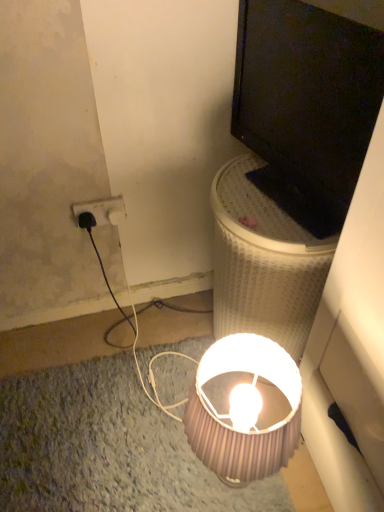
Question: Is black glossy monitor at upper right bigger or smaller than white mesh laundry basket at upper right?

Choices:
 (A) small
 (B) big

Answer: (A)

Question: From their relative heights in the image, would you say black glossy monitor at upper right is taller or shorter than white mesh laundry basket at upper right?

Choices:
 (A) short
 (B) tall

Answer: (A)

Question: Estimate the real-world distances between objects in this image. Which object is farther from the white mesh laundry basket at upper right?

Choices:
 (A) pink ribbed lampshade at lower center
 (B) black plastic power outlet at upper left
 (C) black glossy monitor at upper right

Answer: (B)

Question: Considering the real-world distances, which object is closest to the black plastic power outlet at upper left?

Choices:
 (A) black glossy monitor at upper right
 (B) white mesh laundry basket at upper right
 (C) pink ribbed lampshade at lower center

Answer: (B)